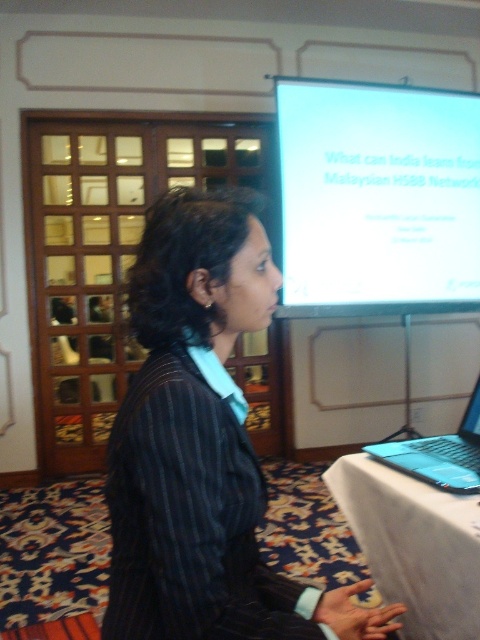
You are a photographer trying to capture a clear shot of the dark pinstripe blazer at center during a presentation. You have a camera that requires a minimum distance of 30 inches to focus properly. Based on the scene, can you get a clear photo?

The dark pinstripe blazer at center and the camera are 29.48 inches apart. Since the required minimum distance is 30 inches, the camera cannot focus properly, so the photo may be blurry.

What is the exact coordinate of the dark pinstripe blazer at center?

The dark pinstripe blazer at center is located at point (203, 445).

You are an attendee at this event and want to take a photo of the slide on the white matte projection screen at upper center. However, the dark pinstripe blazer at center is blocking your view. Can you see the slide clearly?

The dark pinstripe blazer at center is below the white matte projection screen at upper center, so the blazer is not blocking the screen. You can see the slide clearly.